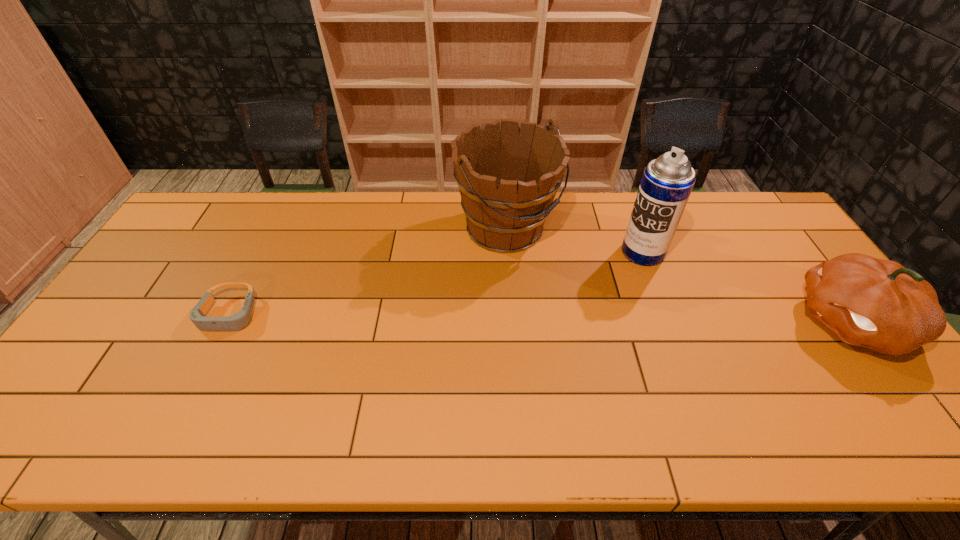
The width and height of the screenshot is (960, 540). What are the coordinates of `goggles` in the screenshot? It's located at tap(239, 320).

Find the location of `the shortest object`. the shortest object is located at coordinates (239, 320).

Find the location of `the third tallest object`. the third tallest object is located at coordinates (879, 304).

Find the location of a particular element. This screenshot has height=540, width=960. the rightmost object is located at coordinates (879, 304).

Image resolution: width=960 pixels, height=540 pixels. In order to click on the third object from left to right in this screenshot , I will do `click(667, 182)`.

At what (x,y) coordinates should I click in order to perform the action: click on wine bucket. Please return your answer as a coordinate pair (x, y). The width and height of the screenshot is (960, 540). Looking at the image, I should click on (507, 180).

Where is `free spot located on the front and back of the leftmost object`? free spot located on the front and back of the leftmost object is located at coordinates (194, 384).

Locate an element on the screen. The height and width of the screenshot is (540, 960). vacant region located on the front face of the rightmost object is located at coordinates (706, 322).

Identify the location of free space located on the front face of the rightmost object. The height and width of the screenshot is (540, 960). (698, 322).

I want to click on free region located 0.100m on the front face of the rightmost object, so click(757, 322).